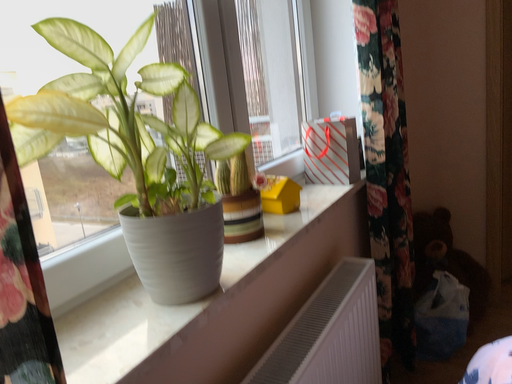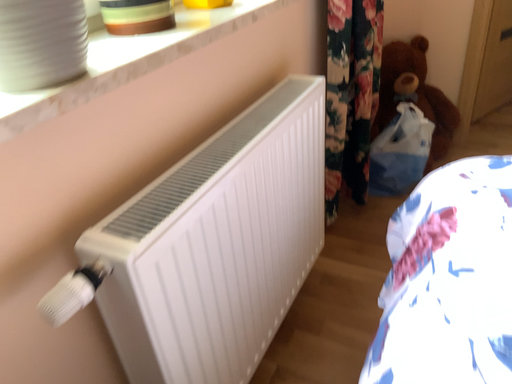
Question: How did the camera likely rotate when shooting the video?

Choices:
 (A) rotated downward
 (B) rotated upward

Answer: (A)